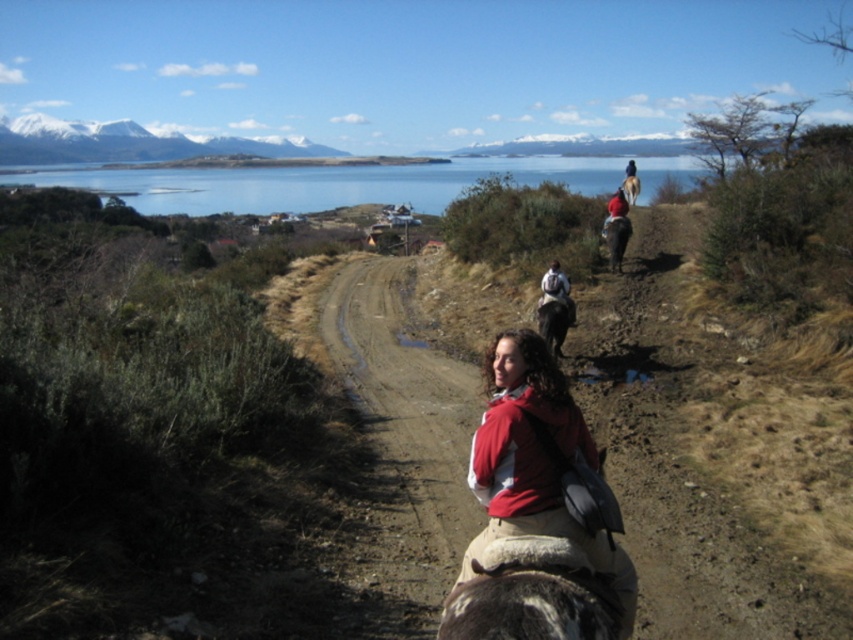
You are a photographer positioned at the scene. You want to capture a photo where the red fleece jacket at center and the brown glossy horse at upper center are both clearly visible. Based on their positions, which object should be placed closer to the camera to ensure both are in focus?

The red fleece jacket at center is already closer to the viewer than the brown glossy horse at upper center. To ensure both are in focus, the photographer should position the camera so that the red fleece jacket at center is closer to the camera, maintaining their natural positions as described.

You are a photographer positioned at the dark blue jacket at upper center and want to take a photo of the brown glossy horse at upper center. The camera has a maximum focus range of 12 meters. Will you be able to focus on the horse?

The brown glossy horse at upper center is 13.12 meters from the dark blue jacket at upper center. Since the camera can only focus up to 12 meters, you wonw be able to focus on the horse.

You are standing at the edge of the dirt path and see the red fleece jacket at center. If you want to reach the jacket, how many steps would you need to take if each step covers 2 feet?

The red fleece jacket at center is 9.40 feet away from the viewer. Since each step covers 2 feet, you would need to take approximately 5 steps to reach it. However, since 5 steps would cover 10 feet, which is slightly more than the distance, you might need to adjust your last step to land precisely at 9.40 feet.